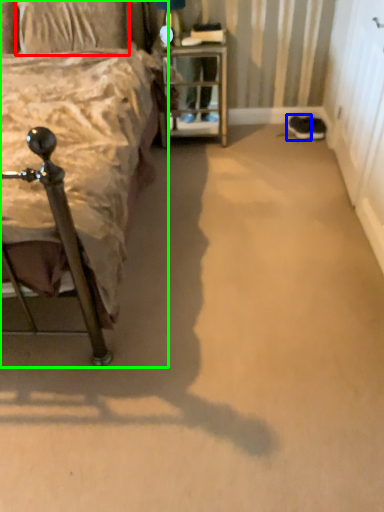
Question: Based on their relative distances, which object is farther from pillow (highlighted by a red box)? Choose from footwear (highlighted by a blue box) and bed (highlighted by a green box).

Choices:
 (A) footwear
 (B) bed

Answer: (A)